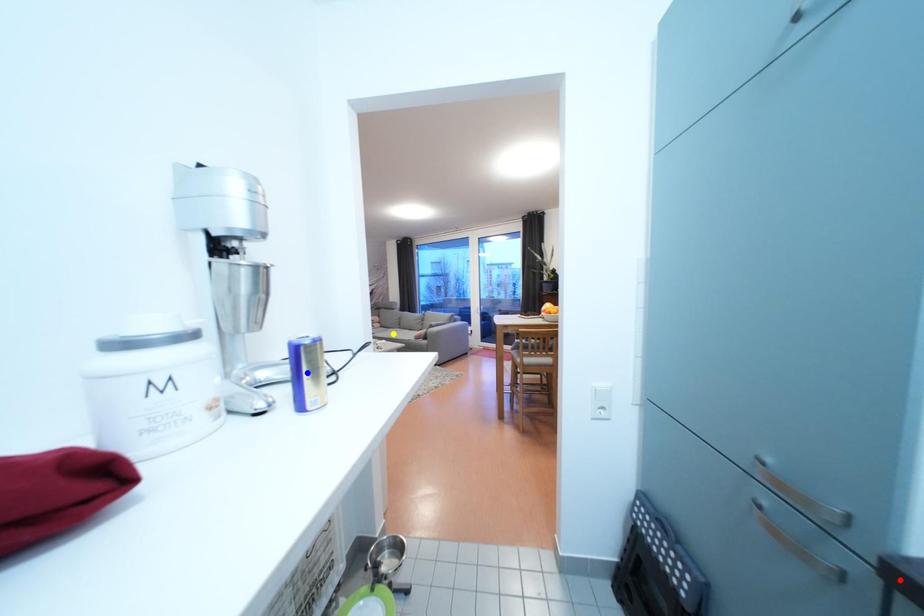
Order these from nearest to farthest:
red point
blue point
yellow point

yellow point < blue point < red point